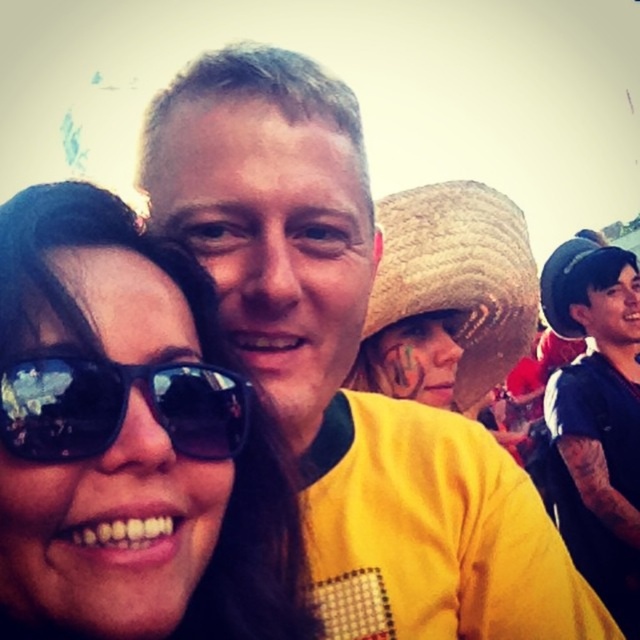
You are a photographer trying to capture a clear shot of the matte black sunglasses at center and the woven straw hat at center. Based on the scene description, which object is positioned lower in the image?

The matte black sunglasses at center is located below woven straw hat at center, so it is positioned lower in the image.